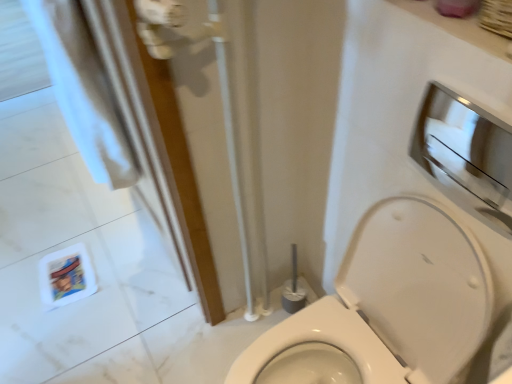
Question: Which is correct: white glossy toilet at center is inside metallic silver medicine cabinet at upper right, or outside of it?

Choices:
 (A) inside
 (B) outside

Answer: (B)

Question: From a real-world perspective, relative to metallic silver medicine cabinet at upper right, is white glossy toilet at center vertically above or below?

Choices:
 (A) above
 (B) below

Answer: (B)

Question: Is white glossy toilet at center to the left or to the right of metallic silver medicine cabinet at upper right in the image?

Choices:
 (A) left
 (B) right

Answer: (A)

Question: Is metallic silver medicine cabinet at upper right situated inside white glossy toilet at center or outside?

Choices:
 (A) inside
 (B) outside

Answer: (B)

Question: Is point (477, 158) closer or farther from the camera than point (453, 233)?

Choices:
 (A) farther
 (B) closer

Answer: (A)

Question: From a real-world perspective, is metallic silver medicine cabinet at upper right positioned above or below white glossy toilet at center?

Choices:
 (A) below
 (B) above

Answer: (B)

Question: In the image, is metallic silver medicine cabinet at upper right positioned in front of or behind white glossy toilet at center?

Choices:
 (A) behind
 (B) front

Answer: (A)